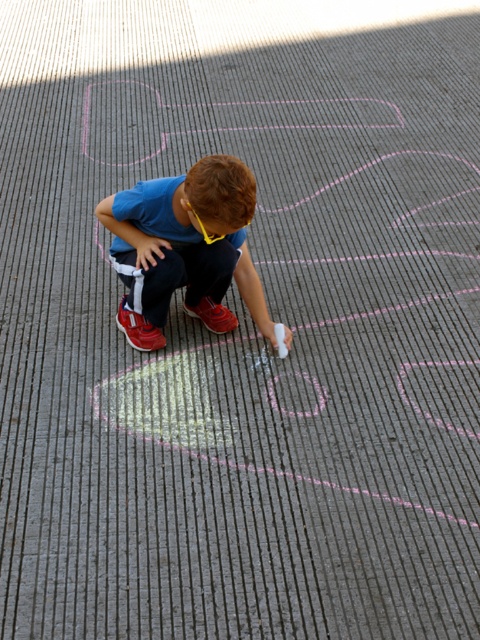
Question: Estimate the real-world distances between objects in this image. Which object is farther from the shiny red sneaker at center?

Choices:
 (A) blue cotton shirt at center
 (B) red suede sneaker at lower center

Answer: (A)

Question: Which of these objects is positioned farthest from the shiny red sneaker at center?

Choices:
 (A) red suede sneaker at lower center
 (B) blue cotton shirt at center

Answer: (B)

Question: Can you confirm if red suede sneaker at lower center is positioned above shiny red sneaker at center?

Choices:
 (A) no
 (B) yes

Answer: (A)

Question: Can you confirm if blue cotton shirt at center is positioned to the left of red suede sneaker at lower center?

Choices:
 (A) yes
 (B) no

Answer: (B)

Question: Is red suede sneaker at lower center to the left of shiny red sneaker at center from the viewer's perspective?

Choices:
 (A) yes
 (B) no

Answer: (A)

Question: Which of these objects is positioned closest to the red suede sneaker at lower center?

Choices:
 (A) blue cotton shirt at center
 (B) shiny red sneaker at center

Answer: (B)